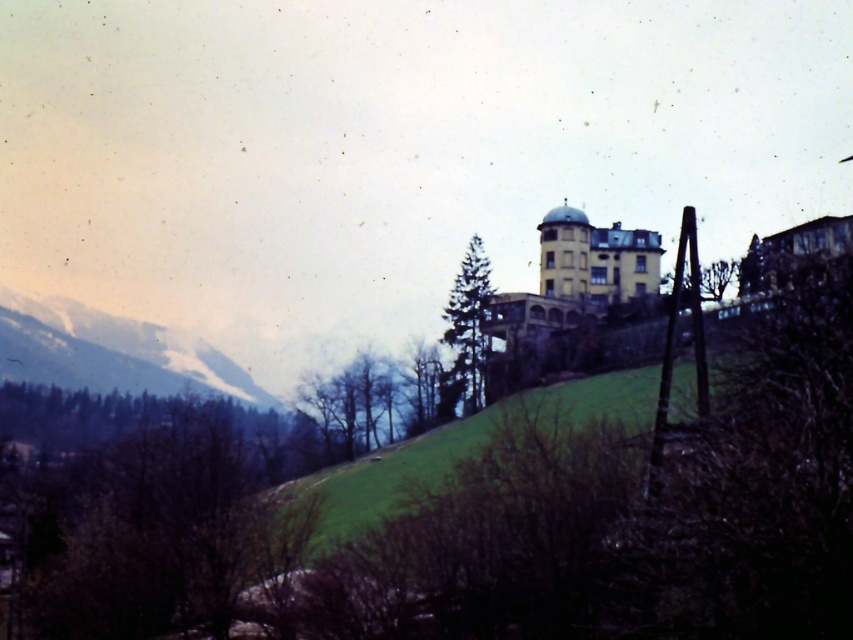
You are standing at the base of the snowy rocky mountain at left and want to walk to the green leafy tree at center. Which direction should you head to reach it?

The snowy rocky mountain at left is positioned over the green leafy tree at center, so you should head towards the center of the image to reach the green leafy tree at center.

You are standing in front of the building on the hill and notice two points marked on the image. The first point is at coordinates point (184, 376) and the second is at point (418, 344). Which point is closer to you?

Point (184, 376) is further to the camera than point (418, 344), so the point closer to you is point (418, 344).